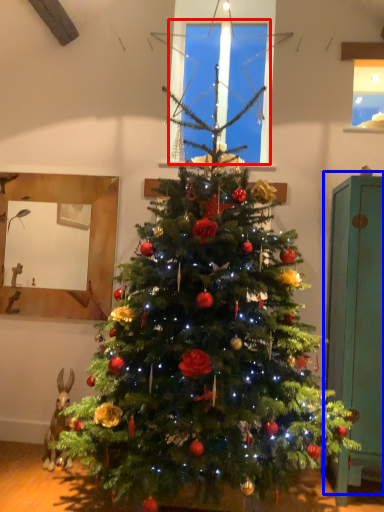
Question: Which object is further to the camera taking this photo, window screen (highlighted by a red box) or armoire (highlighted by a blue box)?

Choices:
 (A) window screen
 (B) armoire

Answer: (A)